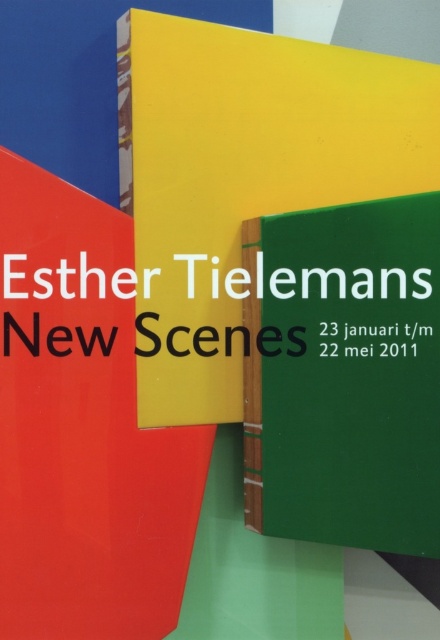
Is point (355, 301) closer to viewer compared to point (377, 344)?

No.

Is green matte signboard at center further to the viewer compared to black paper at center?

No, green matte signboard at center is closer to the viewer.

At what (x,y) coordinates should I click in order to perform the action: click on green matte signboard at center. Please return your answer as a coordinate pair (x, y). This screenshot has width=440, height=640. Looking at the image, I should click on (344, 374).

Find the location of a particular element. matte yellow poster at center is located at coordinates (244, 177).

Does black paper at center have a greater width compared to black matte text at center?

Incorrect, black paper at center's width does not surpass black matte text at center's.

Is black paper at center bigger than black matte text at center?

No, black paper at center is not bigger than black matte text at center.

Does point (406, 340) lie behind point (33, 323)?

No, (406, 340) is in front of (33, 323).

Locate an element on the screen. The height and width of the screenshot is (640, 440). black paper at center is located at coordinates (373, 339).